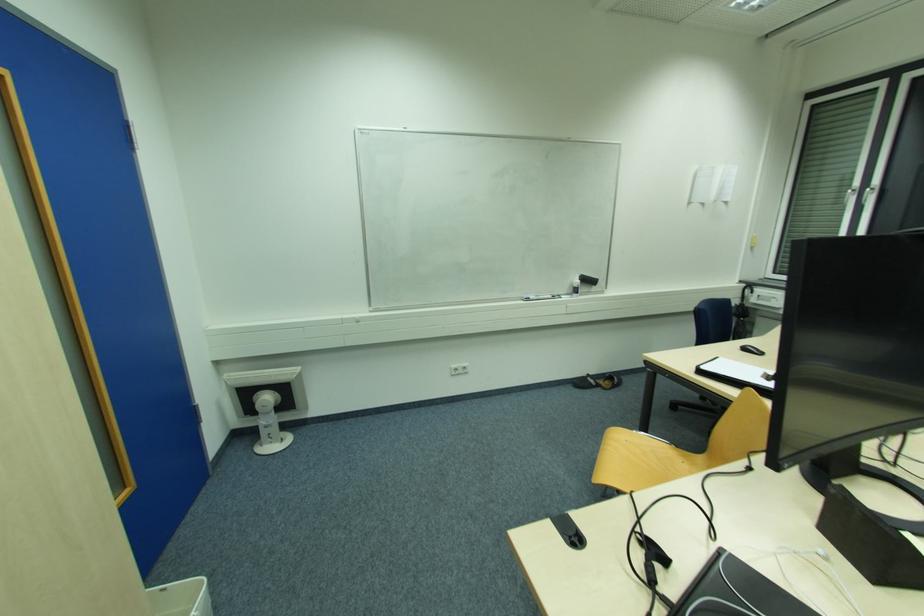
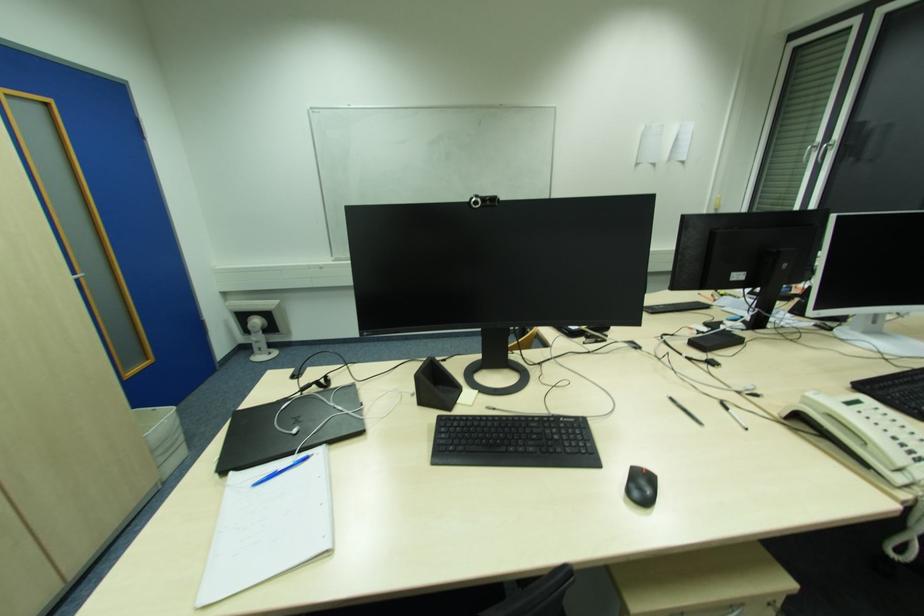
What movement of the cameraman would produce the second image?

The movement direction of the cameraman is right, backward.